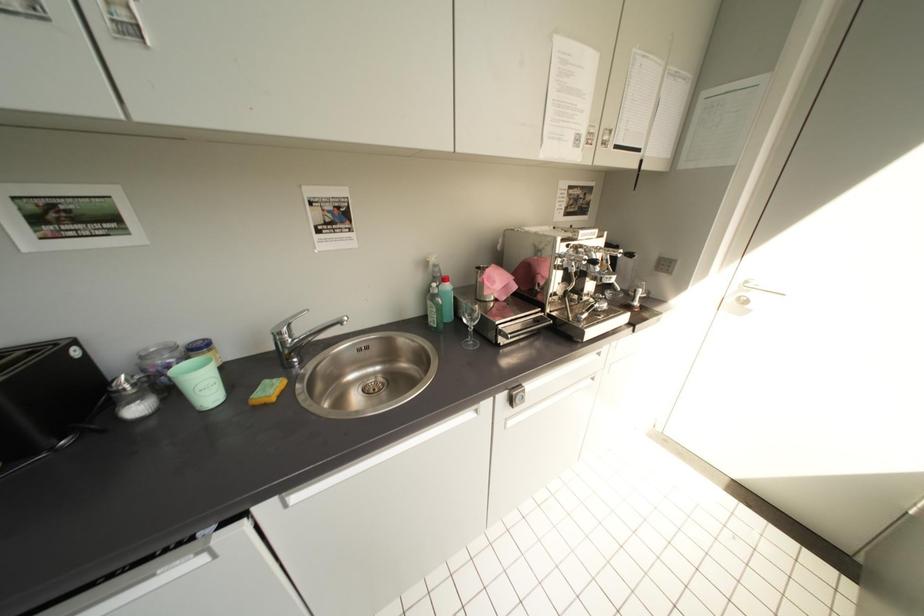
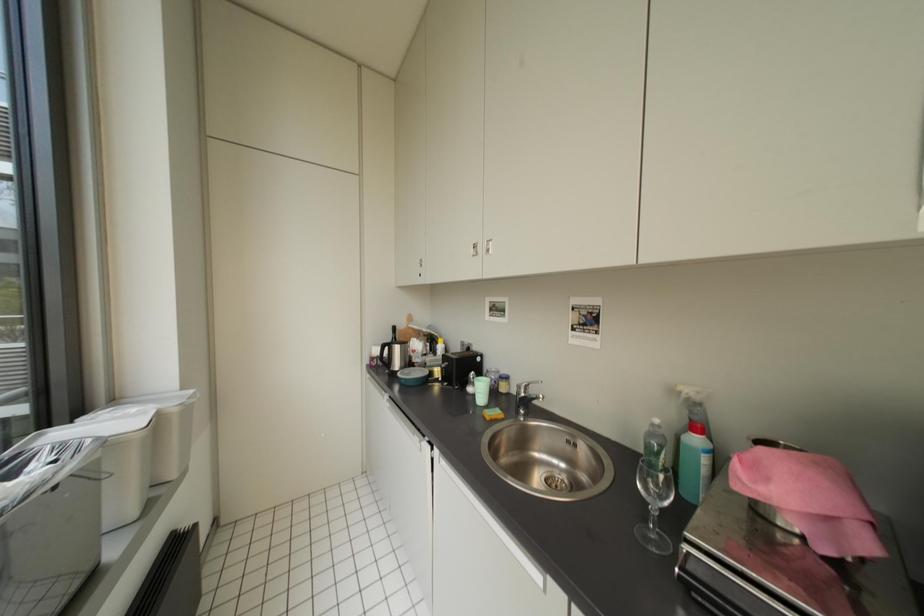
Question: Based on the continuous images, in which direction is the camera rotating? Reply with the corresponding letter.

Choices:
 (A) Left
 (B) Right
 (C) Up
 (D) Down

Answer: (A)